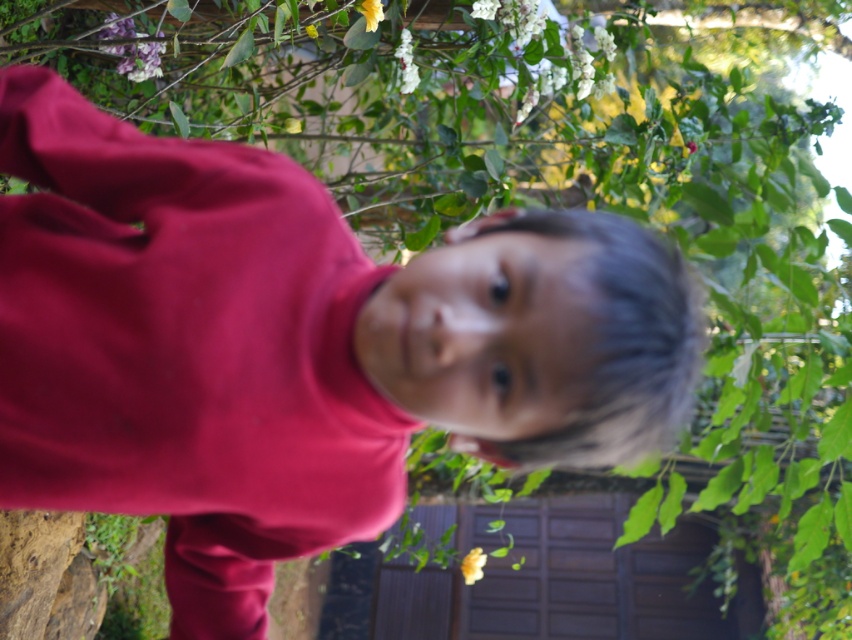
Consider the image. Between white matte flower at upper center and yellow matte flower at lower center, which one is positioned higher?

white matte flower at upper center

In the scene shown: Can you confirm if white matte flower at upper center is taller than yellow matte flower at lower center?

Yes.

The image size is (852, 640). In order to click on white matte flower at upper center in this screenshot , I will do 406,64.

Who is more forward, (x=113, y=51) or (x=412, y=49)?

Point (x=113, y=51) is more forward.

Does matte purple flower at upper left have a lesser width compared to white matte flower at upper center?

No, matte purple flower at upper left is not thinner than white matte flower at upper center.

Where is `matte purple flower at upper left`? The height and width of the screenshot is (640, 852). matte purple flower at upper left is located at coordinates (137, 58).

Which is more to the right, matte purple flower at upper left or yellow matte flower at lower center?

From the viewer's perspective, yellow matte flower at lower center appears more on the right side.

Who is higher up, matte purple flower at upper left or yellow matte flower at lower center?

matte purple flower at upper left

At what (x,y) coordinates should I click in order to perform the action: click on matte purple flower at upper left. Please return your answer as a coordinate pair (x, y). The height and width of the screenshot is (640, 852). Looking at the image, I should click on (137, 58).

I want to click on matte purple flower at upper left, so click(137, 58).